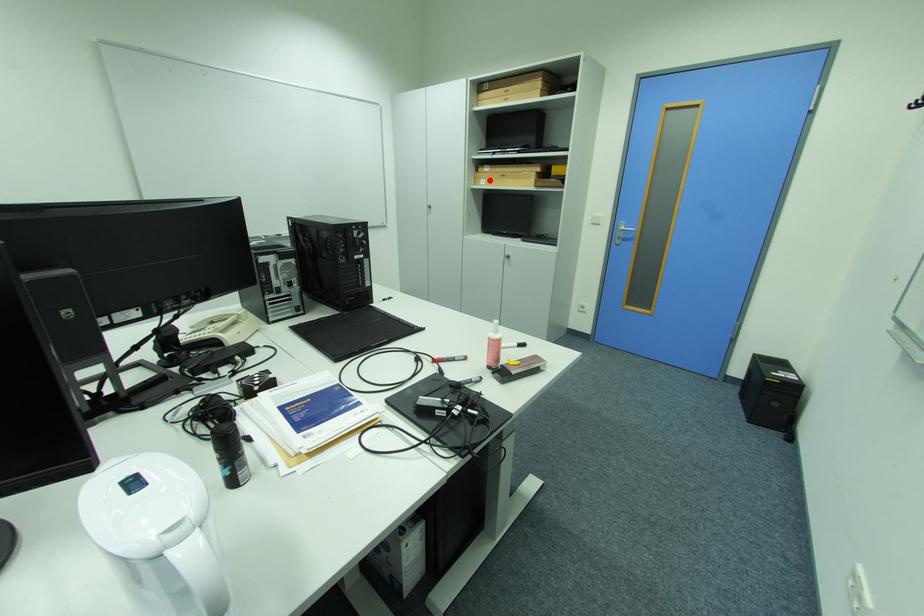
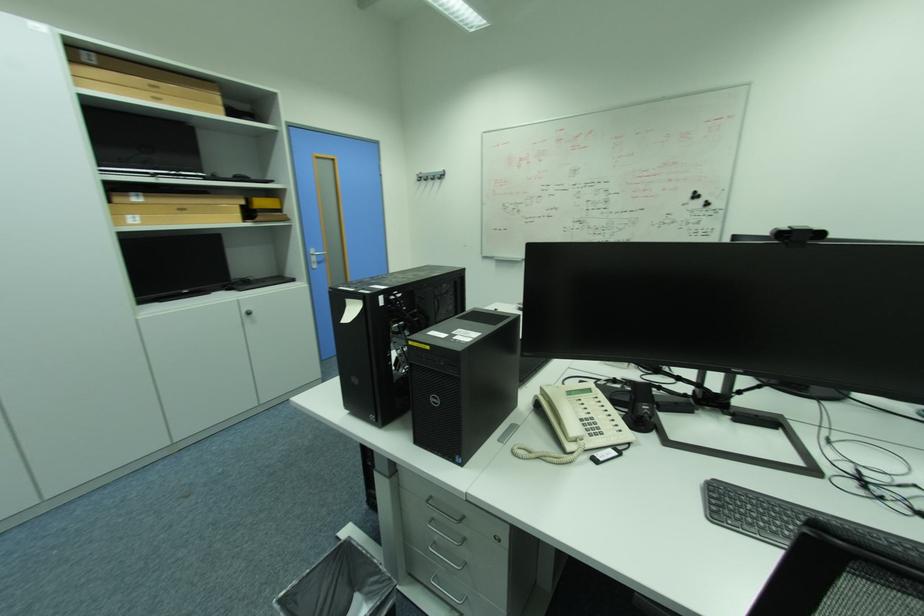
Question: I am providing you with two images of the same scene from different viewpoints. A red point is shown in image1. For the corresponding object point in image2, is it positioned nearer or farther from the camera?

Choices:
 (A) Nearer
 (B) Farther

Answer: (B)